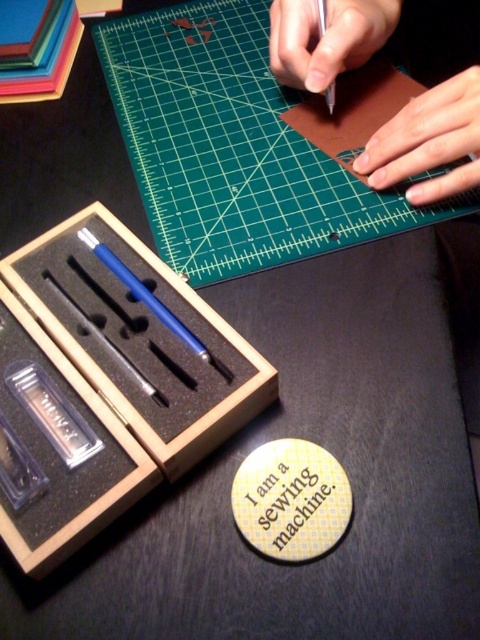
Is green rubber ruler at upper center wider than wooden box at lower left?

Correct, the width of green rubber ruler at upper center exceeds that of wooden box at lower left.

Find the location of a particular element. The height and width of the screenshot is (640, 480). green rubber ruler at upper center is located at coordinates (229, 147).

Who is lower down, smooth skin at upper right or smooth skin hand at upper center?

smooth skin at upper right is below.

Is point (386, 173) positioned in front of point (384, 16)?

Yes, point (386, 173) is in front of point (384, 16).

Does point (456, 77) lie in front of point (372, 51)?

Yes.

The height and width of the screenshot is (640, 480). Identify the location of smooth skin at upper right. (429, 141).

Which is in front, point (349, 26) or point (288, 77)?

Point (349, 26) is more forward.

Is point (389, 157) positioned before point (336, 13)?

Yes, point (389, 157) is closer to viewer.

Locate an element on the screen. smooth leather hands at upper right is located at coordinates (429, 140).